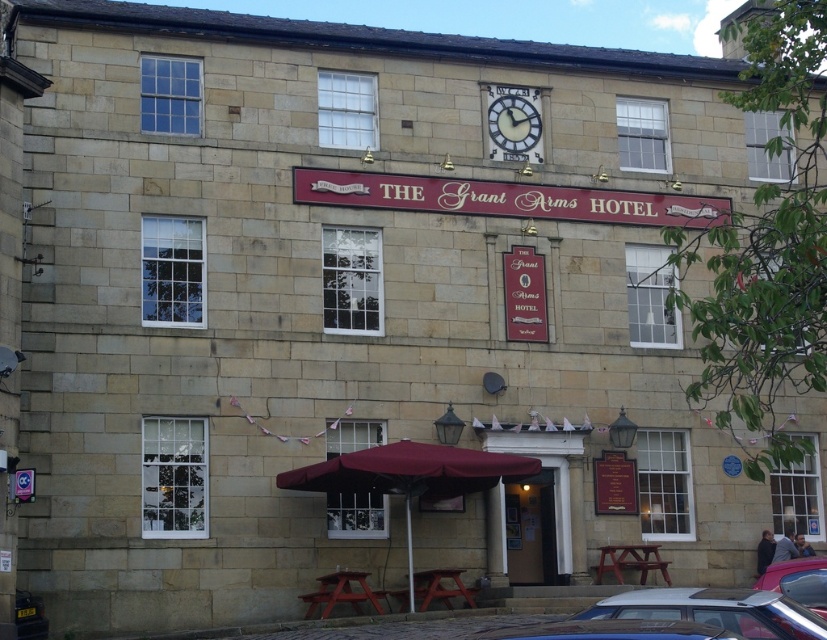
You are a tourist standing in front of the building and want to take a photo that includes both the metallic blue car at lower center and the shiny silver car at lower right. Which car should you position closer to the front of the image to ensure both are visible?

You should position the metallic blue car at lower center closer to the front of the image because it is already below the shiny silver car at lower right, so moving it forward will help both cars be visible in the frame.